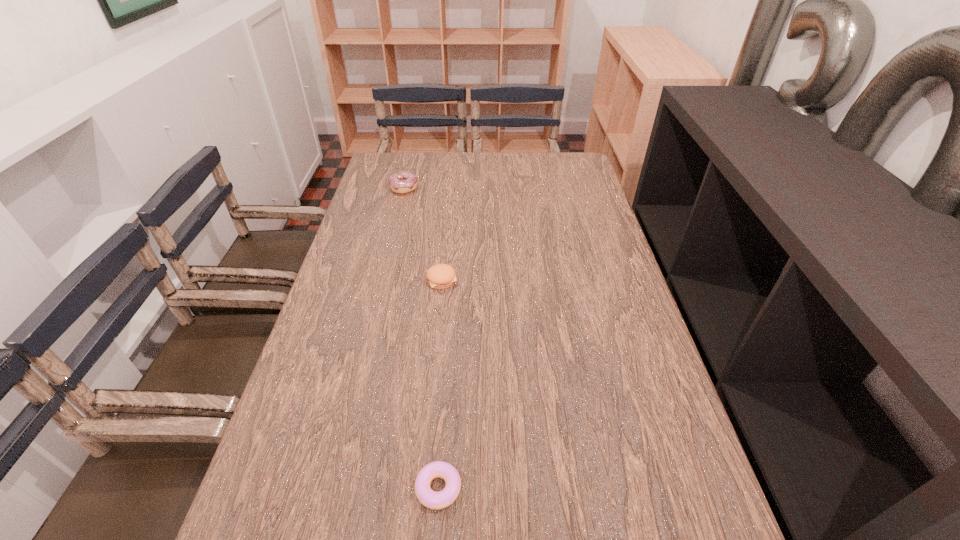
Identify the location of object situated at the left edge. (403, 182).

This screenshot has width=960, height=540. Identify the location of object that is at the far left corner. (403, 182).

Identify the location of vacant space at the far edge of the desktop. (435, 177).

You are a GUI agent. You are given a task and a screenshot of the screen. Output one action in this format:
    pyautogui.click(x=<x>, y=<y>)
    Task: Click on the vacant region at the left edge of the desktop
    The width and height of the screenshot is (960, 540).
    Given the screenshot: What is the action you would take?
    pyautogui.click(x=369, y=265)

At what (x,y) coordinates should I click in order to perform the action: click on vacant region at the right edge of the desktop. Please return your answer as a coordinate pair (x, y). Looking at the image, I should click on (584, 231).

Image resolution: width=960 pixels, height=540 pixels. What are the coordinates of `vacant point located between the taller doughnut and the patty` in the screenshot? It's located at (422, 234).

Find the location of a particular element. free space between the second tallest object and the nearest object is located at coordinates (440, 384).

The image size is (960, 540). What are the coordinates of `free area in between the second nearest object and the farthest object` in the screenshot? It's located at (422, 234).

Where is `free space between the second nearest object and the shortest object`? The height and width of the screenshot is (540, 960). free space between the second nearest object and the shortest object is located at coordinates (440, 384).

Where is `object that is the nearest to the second nearest object`? Image resolution: width=960 pixels, height=540 pixels. object that is the nearest to the second nearest object is located at coordinates (403, 182).